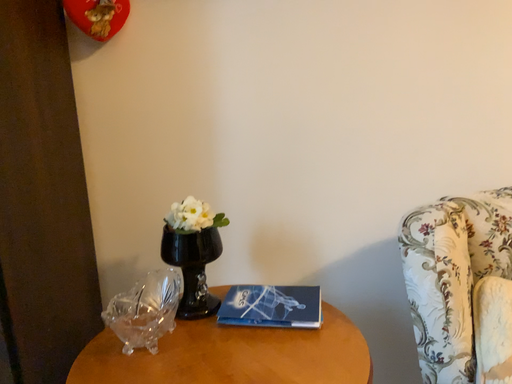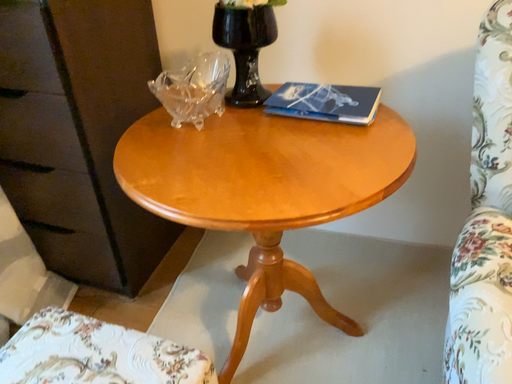
Question: Which way did the camera rotate in the video?

Choices:
 (A) rotated upward
 (B) rotated downward

Answer: (B)